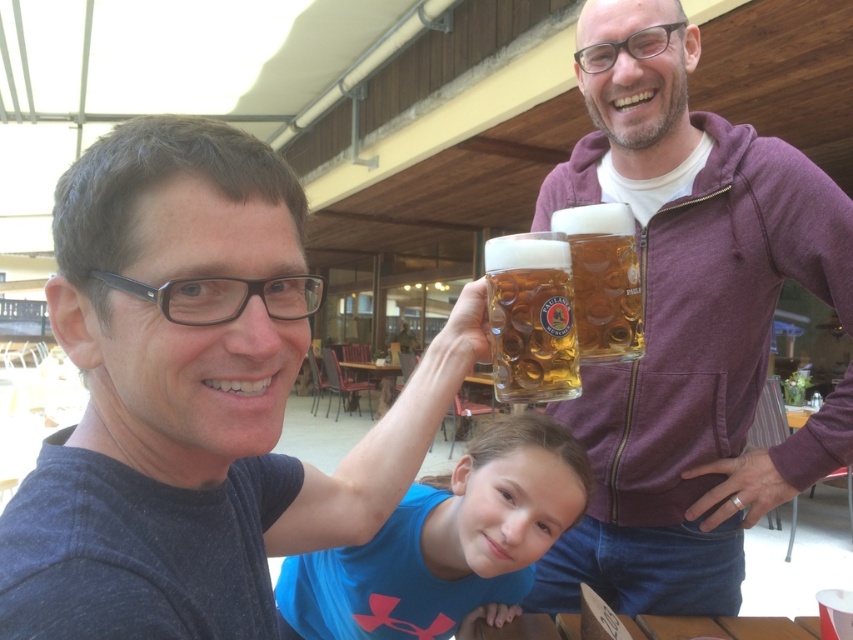
Question: Can you confirm if matte black shirt at upper left is positioned to the right of blue fabric shirt at center?

Choices:
 (A) yes
 (B) no

Answer: (B)

Question: Estimate the real-world distances between objects in this image. Which object is closer to the translucent glass mug at upper center?

Choices:
 (A) golden glass mug at upper center
 (B) matte black shirt at upper left
 (C) matte purple hoodie at upper right

Answer: (A)

Question: Observing the image, what is the correct spatial positioning of matte purple hoodie at upper right in reference to golden glass mug at upper center?

Choices:
 (A) right
 (B) left

Answer: (A)

Question: Where is matte black shirt at upper left located in relation to translucent glass mug at upper center in the image?

Choices:
 (A) right
 (B) left

Answer: (B)

Question: Considering the real-world distances, which object is farthest from the golden glass mug at upper center?

Choices:
 (A) matte black shirt at upper left
 (B) matte purple hoodie at upper right

Answer: (B)

Question: Considering the real-world distances, which object is farthest from the blue fabric shirt at center?

Choices:
 (A) translucent glass mug at upper center
 (B) golden glass mug at upper center
 (C) matte purple hoodie at upper right

Answer: (A)